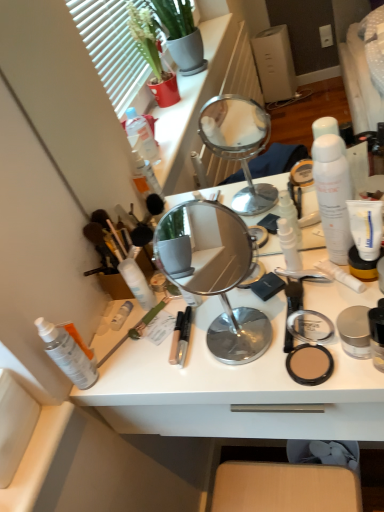
Where is `vacant area that lies between green matte brush at center and white matte lotion at center, the 5th toiletry when ordered from left to right`? The width and height of the screenshot is (384, 512). vacant area that lies between green matte brush at center and white matte lotion at center, the 5th toiletry when ordered from left to right is located at coordinates (201, 309).